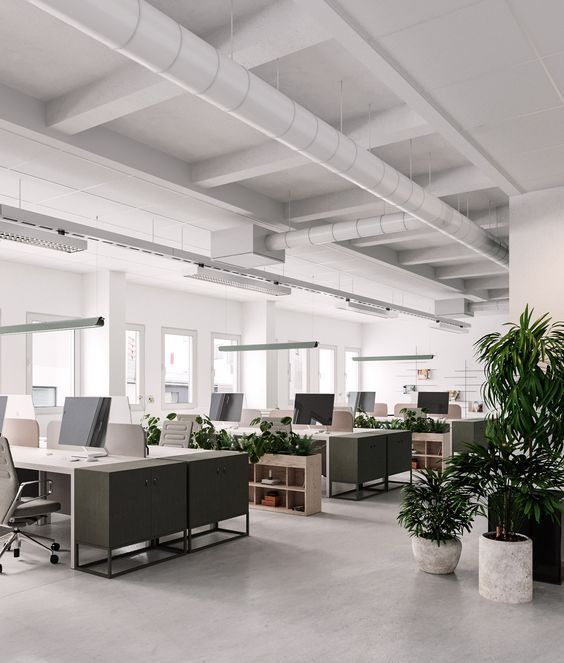
Identify the location of cubbies. The image size is (564, 663). (299, 471), (294, 497), (272, 475), (268, 489), (254, 473), (250, 490), (431, 447), (431, 461), (418, 447), (417, 465).